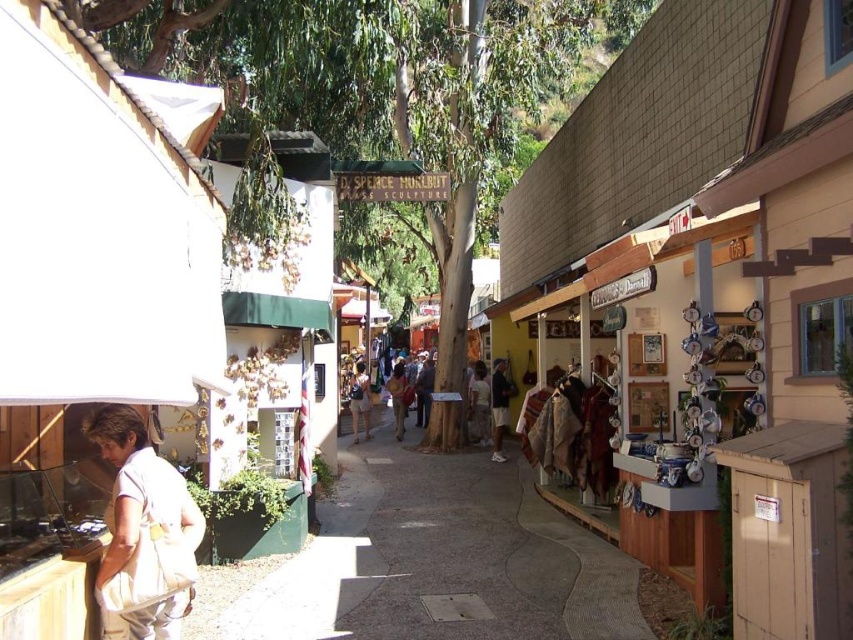
You are a photographer trying to capture the scene from the street level. You notice the white cotton shirt at lower left and the dark blue jeans at center. Which clothing item is closer to your camera lens?

The white cotton shirt at lower left is closer to the camera lens because it is positioned in front of the dark blue jeans at center.

You are a delivery person who needs to place a large package on the concrete sidewalk at center and the denim shorts at center. Which location has enough space to accommodate the package?

The denim shorts at center has more space than the concrete sidewalk at center, so the package should be placed there.